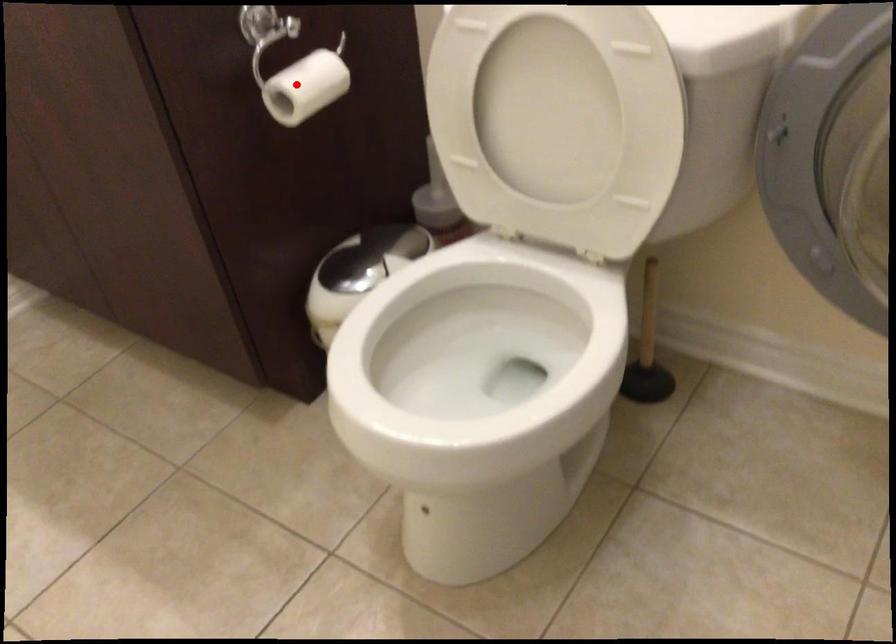
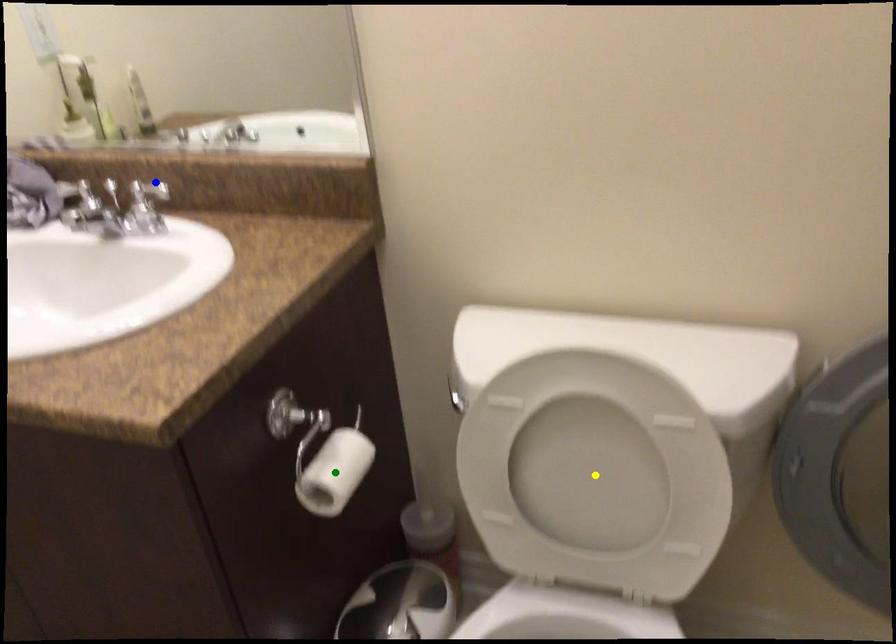
Question: I am providing you with two images of the same scene from different viewpoints. A red point is marked on the first image. You are given multiple points on the second image. Which mark in image 2 goes with the point in image 1?

Choices:
 (A) blue point
 (B) yellow point
 (C) green point

Answer: (C)